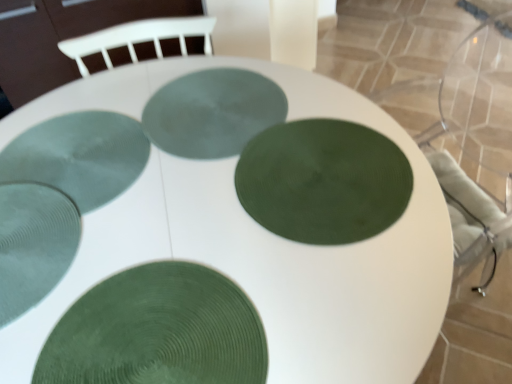
The width and height of the screenshot is (512, 384). In order to click on space that is in front of green textured glass plate at center, which is the 1th glass plate in back-to-front order in this screenshot , I will do `click(214, 210)`.